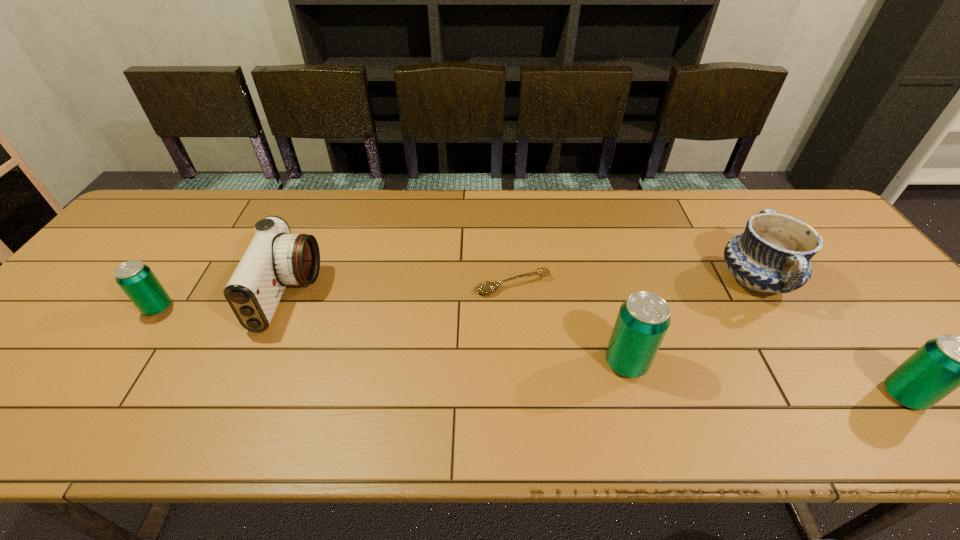
At what (x,y) coordinates should I click in order to perform the action: click on vacant space at the right edge. Please return your answer as a coordinate pair (x, y). This screenshot has height=540, width=960. Looking at the image, I should click on click(841, 302).

In the image, there is a desktop. In order to click on vacant region at the far left corner in this screenshot , I will do `click(176, 204)`.

Locate an element on the screen. This screenshot has width=960, height=540. vacant space at the near left corner of the desktop is located at coordinates (66, 369).

Where is `vacant area between the rightmost object and the second beer can from left to right`? This screenshot has height=540, width=960. vacant area between the rightmost object and the second beer can from left to right is located at coordinates (765, 379).

Where is `free spot between the second shortest beer can and the second beer can from left to right`? This screenshot has height=540, width=960. free spot between the second shortest beer can and the second beer can from left to right is located at coordinates [765, 379].

The height and width of the screenshot is (540, 960). I want to click on free spot between the second object from right to left and the second beer can from right to left, so click(690, 321).

At what (x,y) coordinates should I click in order to perform the action: click on empty location between the pottery and the ladle. Please return your answer as a coordinate pair (x, y). This screenshot has height=540, width=960. Looking at the image, I should click on (634, 282).

At what (x,y) coordinates should I click in order to perform the action: click on free space that is in between the second object from left to right and the second beer can from left to right. Please return your answer as a coordinate pair (x, y). The image size is (960, 540). Looking at the image, I should click on tap(458, 328).

Where is `empty location between the shortest object and the second shortest beer can`? Image resolution: width=960 pixels, height=540 pixels. empty location between the shortest object and the second shortest beer can is located at coordinates (708, 340).

Where is `free space between the camcorder and the fourth object from right to left`? free space between the camcorder and the fourth object from right to left is located at coordinates (401, 289).